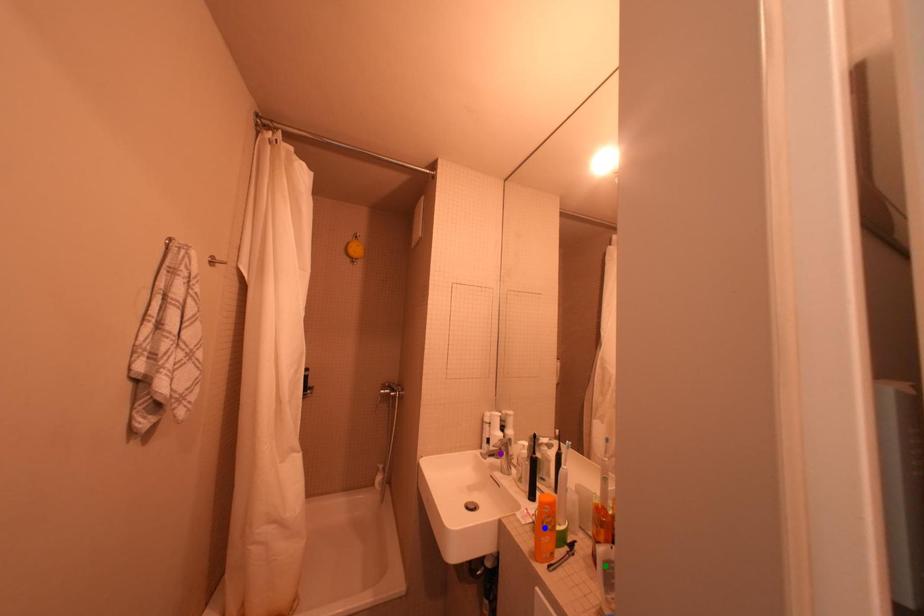
Order these from nearest to farthest:
1. blue point
2. purple point
3. green point

green point → blue point → purple point